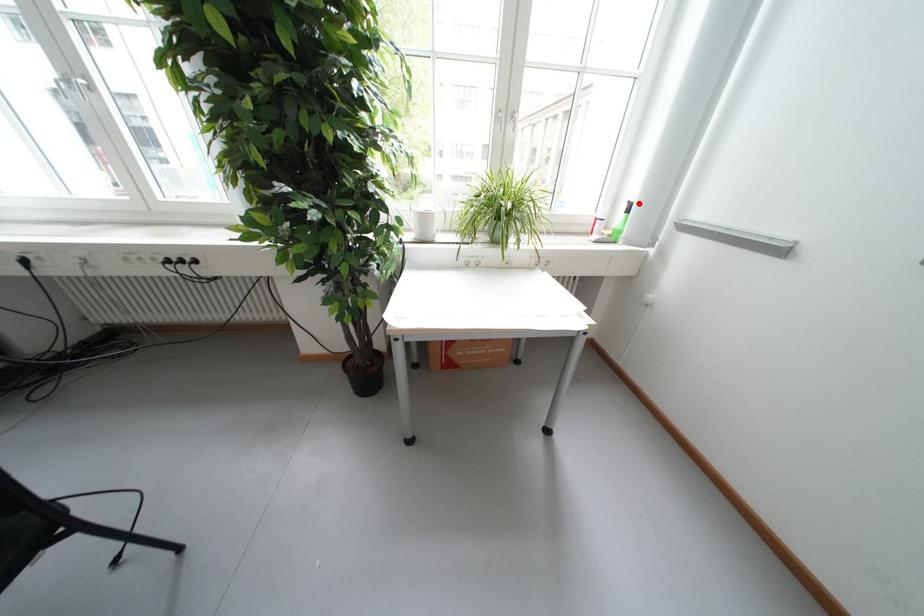
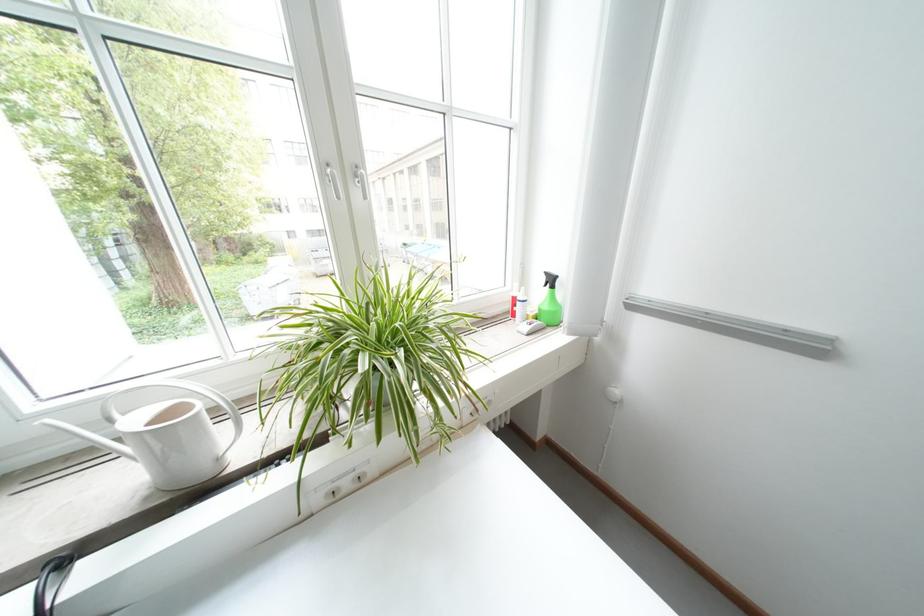
In the second image, find the point that corresponds to the highlighted location in the first image.

(555, 275)